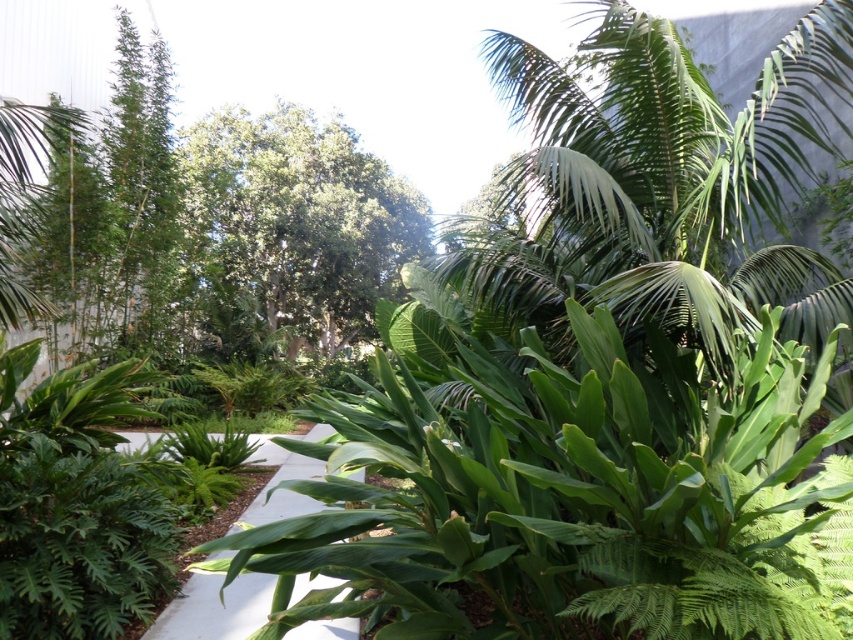
You are a gardener who wants to install a new light fixture above the white concrete path at center. Considering the green leafy tree at center, will the tree interfere with the installation? Please explain.

The green leafy tree at center is much taller than the white concrete path at center, so its branches may extend over the path, potentially interfering with the installation of the light fixture. You should assess the tree canopy height and spread before proceeding.

You are a gardener planning to install a new sprinkler system in the tropical garden. The sprinkler requires a clear space of 2 meters in diameter. Can the green leafy tree at center and the white concrete path at center accommodate this requirement?

The green leafy tree at center has a larger size compared to the white concrete path at center. Since the tree is bigger, it might occupy more space, but the path is smaller. However, the question is about the sprinkler needing 2 meters. Without exact measurements of the path, it is uncertain if the path is wide enough. The answer should focus on the objects described. Since the tree is larger, but the path is the area where the sprinkler could be placed. The description does not specify the path width. So,